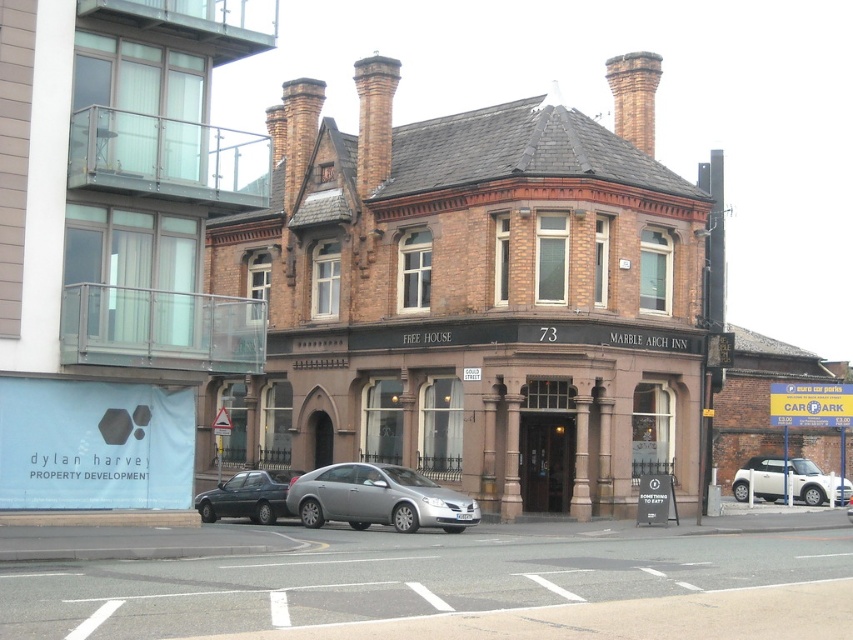
Question: Which of these objects is positioned farthest from the metallic gray sedan at lower left?

Choices:
 (A) brown brick building at center
 (B) smooth asphalt road at lower center
 (C) brick building at center
 (D) white matte car at lower right

Answer: (D)

Question: Can you confirm if smooth asphalt road at lower center is bigger than white matte car at lower right?

Choices:
 (A) no
 (B) yes

Answer: (B)

Question: Is silver metallic sedan at center wider than white matte car at lower right?

Choices:
 (A) no
 (B) yes

Answer: (B)

Question: Considering the real-world distances, which object is closest to the brick building at center?

Choices:
 (A) metallic gray sedan at lower left
 (B) smooth asphalt road at lower center
 (C) brown brick building at center
 (D) white matte car at lower right

Answer: (C)

Question: Which object is farther from the camera taking this photo?

Choices:
 (A) white matte car at lower right
 (B) brown brick building at center

Answer: (A)

Question: Is brick building at center positioned at the back of silver metallic sedan at center?

Choices:
 (A) yes
 (B) no

Answer: (B)